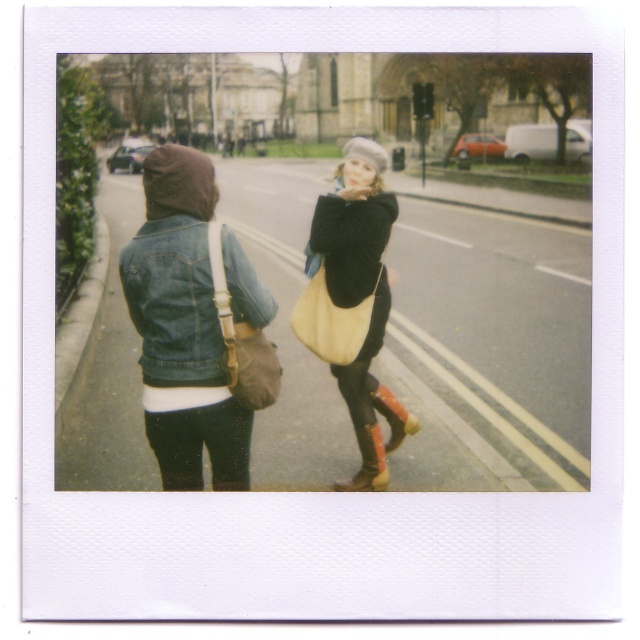
You are a photographer trying to capture a closeup of the matte yellow bag at center and the leather tan bag at center in the Polaroid photo. Which bag should you focus on if you want to highlight the smaller one?

The matte yellow bag at center has a lesser height compared to the leather tan bag at center, so you should focus on the matte yellow bag at center to highlight the smaller one.

You are a photographer who wants to capture a closeup of the matte yellow bag at center and the leather boot at lower center. Based on their positions, which object should you focus on first to ensure both are in sharp focus?

The matte yellow bag at center is above the leather boot at lower center, so focusing on the matte yellow bag at center first will ensure both are in sharp focus since it is closer to the camera.

You are a photographer analyzing the composition of this Polaroid photo. The image has a square format with a textured white border. You notice two people walking along a street with a blurred background. There is a matte yellow bag at center. Where is the matte yellow bag positioned in relation to the two people?

The matte yellow bag at center is located at point coordinates approximately 0.464 on the horizontal axis and 0.564 on the vertical axis, which places it centrally within the frame.